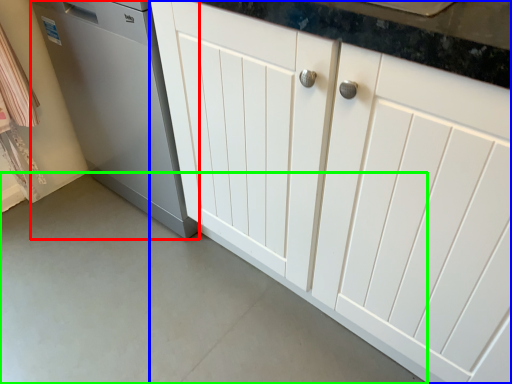
Question: Considering the real-world distances, which object is closest to home appliance (highlighted by a red box)? cabinetry (highlighted by a blue box) or concrete (highlighted by a green box).

Choices:
 (A) cabinetry
 (B) concrete

Answer: (A)